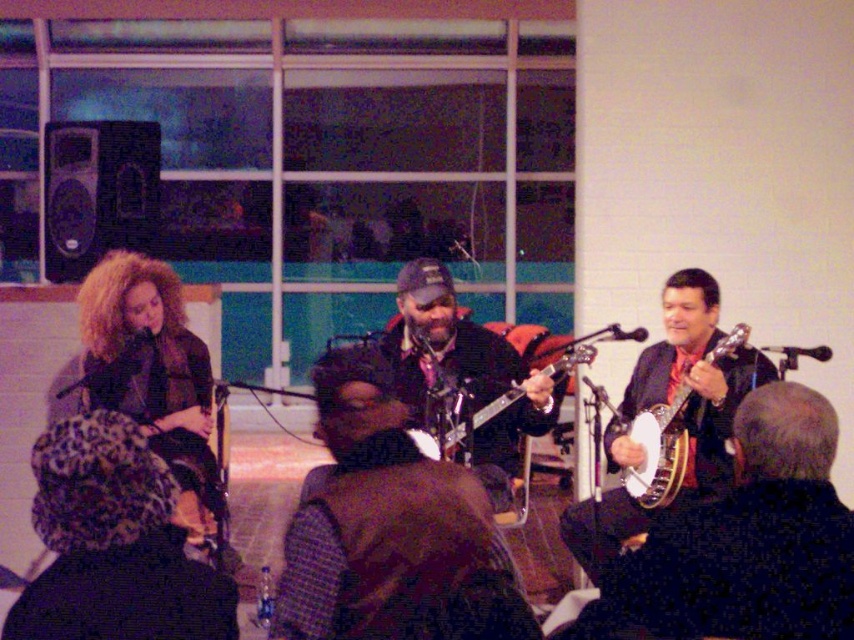
Question: Is matte black banjo at center positioned at the back of glossy black banjo at center?

Choices:
 (A) yes
 (B) no

Answer: (A)

Question: Estimate the real-world distances between objects in this image. Which object is closer to the shiny black banjo at center?

Choices:
 (A) wooden banjo at right
 (B) matte black banjo at center
 (C) shiny brown banjo at center

Answer: (A)

Question: Can you confirm if shiny black banjo at center is positioned to the left of matte black banjo at center?

Choices:
 (A) no
 (B) yes

Answer: (A)

Question: Is the position of shiny black banjo at center less distant than that of wooden banjo at right?

Choices:
 (A) no
 (B) yes

Answer: (B)

Question: Among these points, which one is farthest from the camera?

Choices:
 (A) (566, 364)
 (B) (667, 472)

Answer: (A)

Question: Which object is farther from the camera taking this photo?

Choices:
 (A) shiny black banjo at center
 (B) shiny brown banjo at center
 (C) glossy black banjo at center

Answer: (B)